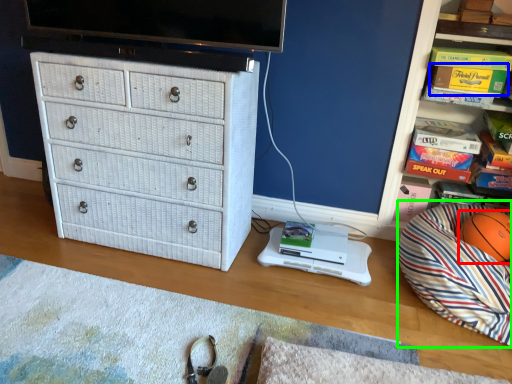
Question: Which object is positioned closest to ball (highlighted by a red box)? Select from magazine (highlighted by a blue box) and bean bag chair (highlighted by a green box).

Choices:
 (A) magazine
 (B) bean bag chair

Answer: (B)